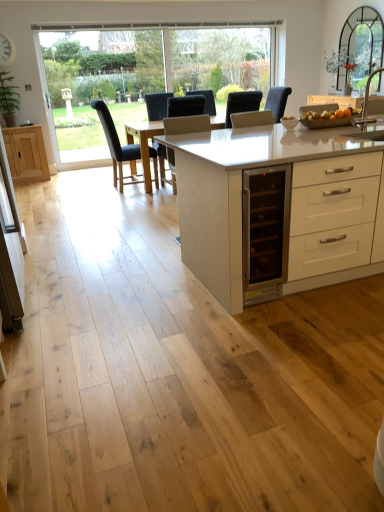
Image resolution: width=384 pixels, height=512 pixels. What do you see at coordinates (26, 154) in the screenshot? I see `matte oak cabinet at left` at bounding box center [26, 154].

Measure the distance between silver metallic sink at right and camera.

silver metallic sink at right and camera are 2.81 meters apart from each other.

What do you see at coordinates (368, 120) in the screenshot? This screenshot has width=384, height=512. I see `silver metallic sink at right` at bounding box center [368, 120].

You are a GUI agent. You are given a task and a screenshot of the screen. Output one action in this format:
    pyautogui.click(x=<x>, y=<y>)
    Task: Click on the black leather chair at center, placed as the second chair when sorted from right to left
    The height and width of the screenshot is (512, 384).
    Given the screenshot: What is the action you would take?
    [116, 146]

Considering the relative sizes of silver metallic sink at right and black leather chair at center, which is the 1th chair in left-to-right order, in the image provided, is silver metallic sink at right bigger than black leather chair at center, which is the 1th chair in left-to-right order,?

No.

Can you tell me how much silver metallic sink at right and black leather chair at center, placed as the second chair when sorted from right to left, differ in facing direction?

The angular difference between silver metallic sink at right and black leather chair at center, placed as the second chair when sorted from right to left, is 89.6 degrees.

Is silver metallic sink at right outside of black leather chair at center, placed as the second chair when sorted from right to left?

Yes, silver metallic sink at right is outside of black leather chair at center, placed as the second chair when sorted from right to left.

From the image's perspective, which one is positioned lower, silver metallic sink at right or black leather chair at center, which is the 1th chair in left-to-right order?

silver metallic sink at right, from the image's perspective.

From the picture: Is white glossy table at center wider than dark gray fabric chair at center, which is the first chair in right-to-left order?

Yes.

Is white glossy table at center shorter than dark gray fabric chair at center, which is the 2th chair in left-to-right order?

Yes.

Is white glossy table at center not within dark gray fabric chair at center, which is the 2th chair in left-to-right order?

Yes, white glossy table at center is outside of dark gray fabric chair at center, which is the 2th chair in left-to-right order.

Who is smaller, white glossy table at center or dark gray fabric chair at center, which is the first chair in right-to-left order?

With smaller size is dark gray fabric chair at center, which is the first chair in right-to-left order.

Is silver metallic sink at right wider than white glossy table at center?

No.

From the image's perspective, is silver metallic sink at right over white glossy table at center?

Yes, from the image's perspective, silver metallic sink at right is above white glossy table at center.

Consider the image. Can you tell me how much silver metallic sink at right and white glossy table at center differ in facing direction?

The angular difference between silver metallic sink at right and white glossy table at center is 0.671 degrees.

From the image's perspective, does black leather chair at center, which is the 1th chair in left-to-right order, appear lower than clear glass window at upper left?

Yes.

Does point (132, 144) appear closer or farther from the camera than point (192, 32)?

Point (132, 144).

From a real-world perspective, which object rests below the other?

From a 3D spatial view, black leather chair at center, which is the 1th chair in left-to-right order, is below.

Which object is wider, black leather chair at center, which is the 1th chair in left-to-right order, or clear glass window at upper left?

black leather chair at center, which is the 1th chair in left-to-right order.

From the image's perspective, which object appears higher, white glossy table at center or silver metallic sink at right?

silver metallic sink at right, from the image's perspective.

Identify the location of table in front of the silver metallic sink at right. (283, 208).

Is point (183, 260) in front of point (374, 105)?

No, it is behind (374, 105).

Based on the photo, considering the sizes of objects white glossy table at center and silver metallic sink at right in the image provided, who is taller, white glossy table at center or silver metallic sink at right?

With more height is white glossy table at center.

Which object is thinner, white glossy table at center or matte oak cabinet at left?

Thinner between the two is matte oak cabinet at left.

From the image's perspective, is white glossy table at center above or below matte oak cabinet at left?

Clearly, from the image's perspective, white glossy table at center is below matte oak cabinet at left.

Is white glossy table at center positioned with its back to matte oak cabinet at left?

No, white glossy table at center is not facing away from matte oak cabinet at left.

Is point (359, 244) in front of point (37, 172)?

Yes.

Considering the sizes of objects matte oak cabinet at left and white glossy table at center in the image provided, who is bigger, matte oak cabinet at left or white glossy table at center?

white glossy table at center is bigger.

How different are the orientations of matte oak cabinet at left and white glossy table at center in degrees?

The angle between the facing direction of matte oak cabinet at left and the facing direction of white glossy table at center is 179 degrees.

Is matte oak cabinet at left turned away from white glossy table at center?

matte oak cabinet at left does not have its back to white glossy table at center.

The image size is (384, 512). What are the coordinates of `table located below the matte oak cabinet at left (from the image's perspective)` in the screenshot? It's located at (283, 208).

The image size is (384, 512). Identify the location of sink below the black leather chair at center, which is the 1th chair in left-to-right order (from the image's perspective). (368, 120).

Starting from the white glossy table at center, which chair is the 1st one behind? Please provide its 2D coordinates.

[(186, 115)]

From the image, which object appears to be farther from dark gray fabric chair at center, which is the 2th chair in left-to-right order, white glossy table at center or black leather chair at center, which is the 1th chair in left-to-right order?

white glossy table at center is positioned further to the anchor dark gray fabric chair at center, which is the 2th chair in left-to-right order.

Looking at the image, which one is located further to clear glass window at upper left, white glossy table at center or silver metallic sink at right?

Based on the image, silver metallic sink at right appears to be further to clear glass window at upper left.

Estimate the real-world distances between objects in this image. Which object is closer to black leather chair at center, which is the 1th chair in left-to-right order, clear glass window at upper left or matte oak cabinet at left?

The object closer to black leather chair at center, which is the 1th chair in left-to-right order, is matte oak cabinet at left.

Considering their positions, is black leather chair at center, placed as the second chair when sorted from right to left, positioned closer to matte oak cabinet at left than silver metallic sink at right?

Among the two, black leather chair at center, placed as the second chair when sorted from right to left, is located nearer to matte oak cabinet at left.

Looking at the image, which one is located closer to black leather chair at center, which is the 1th chair in left-to-right order, white glossy table at center or silver metallic sink at right?

white glossy table at center.

From the image, which object appears to be nearer to dark gray fabric chair at center, which is the 2th chair in left-to-right order, silver metallic sink at right or matte oak cabinet at left?

The object closer to dark gray fabric chair at center, which is the 2th chair in left-to-right order, is silver metallic sink at right.

Estimate the real-world distances between objects in this image. Which object is closer to white glossy table at center, clear glass window at upper left or silver metallic sink at right?

The object closer to white glossy table at center is silver metallic sink at right.

Which object lies further to the anchor point silver metallic sink at right, dark gray fabric chair at center, which is the first chair in right-to-left order, or white glossy table at center?

Based on the image, dark gray fabric chair at center, which is the first chair in right-to-left order, appears to be further to silver metallic sink at right.

Where is `sink positioned between white glossy table at center and clear glass window at upper left from near to far`? This screenshot has width=384, height=512. sink positioned between white glossy table at center and clear glass window at upper left from near to far is located at coordinates (368, 120).

Find the location of `chair positioned between white glossy table at center and black leather chair at center, placed as the second chair when sorted from right to left, from near to far`. chair positioned between white glossy table at center and black leather chair at center, placed as the second chair when sorted from right to left, from near to far is located at coordinates (186, 115).

Locate an element on the screen. This screenshot has width=384, height=512. cabinetry located between white glossy table at center and clear glass window at upper left in the depth direction is located at coordinates (26, 154).

The height and width of the screenshot is (512, 384). Identify the location of sink between white glossy table at center and dark gray fabric chair at center, which is the first chair in right-to-left order, in the front-back direction. (368, 120).